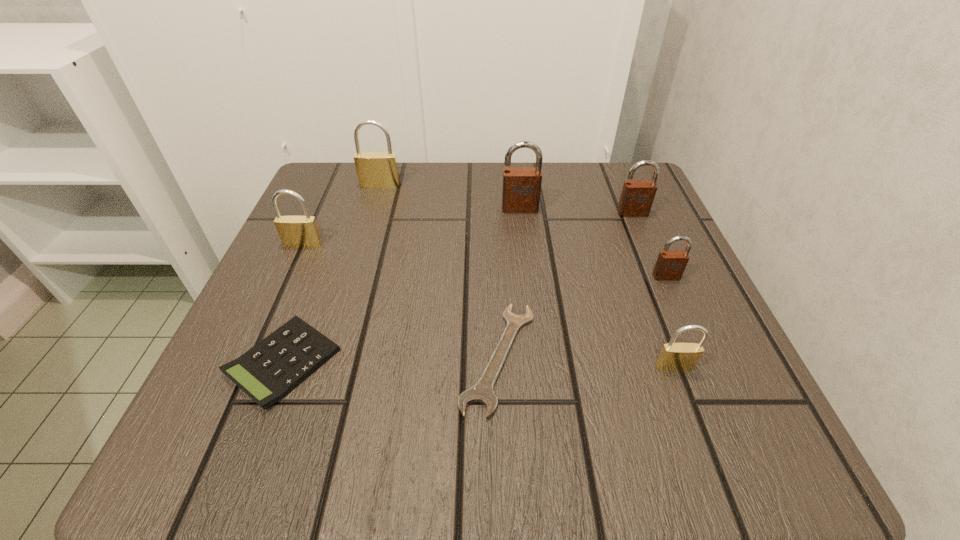
Choose which brown padlock is the second nearest neighbor to the fourth nearest object. Please provide its 2D coordinates. Your answer should be formatted as a tuple, i.e. [(x, y)], where the tuple contains the x and y coordinates of a point satisfying the conditions above.

[(521, 189)]

Select which brown padlock appears as the closest to the fifth padlock from right to left. Please provide its 2D coordinates. Your answer should be formatted as a tuple, i.e. [(x, y)], where the tuple contains the x and y coordinates of a point satisfying the conditions above.

[(521, 189)]

Locate an element on the screen. vacant space that satisfies the following two spatial constraints: 1. on the front-facing side of the calculator; 2. on the left side of the fourth farthest object is located at coordinates (251, 362).